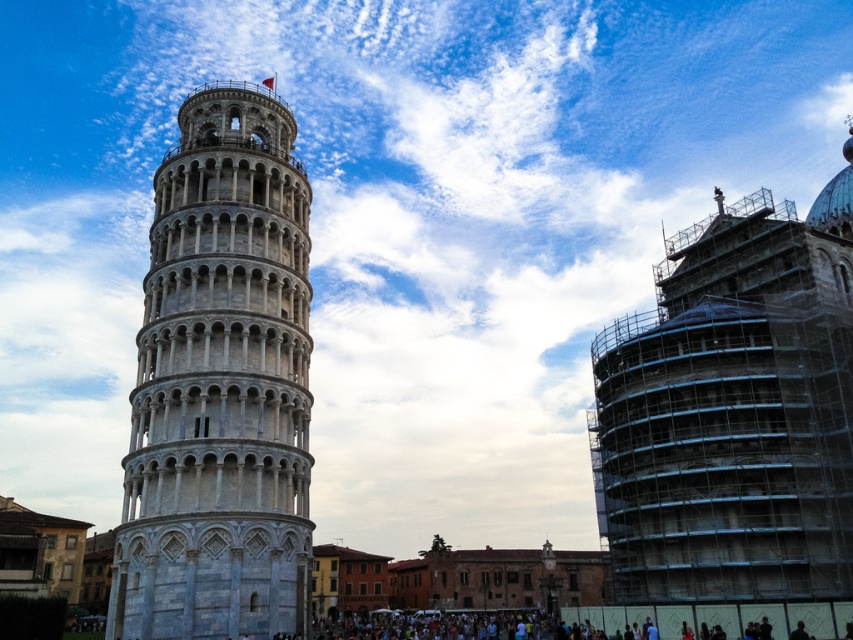
How distant is gray stone tower at center from dark clothing crowd at lower center?

33.04 meters

How distant is gray stone tower at center from dark clothing crowd at lower center?

gray stone tower at center and dark clothing crowd at lower center are 33.04 meters apart from each other.

Is point (152, 560) more distant than point (639, 605)?

No.

Locate an element on the screen. This screenshot has height=640, width=853. gray stone tower at center is located at coordinates (219, 385).